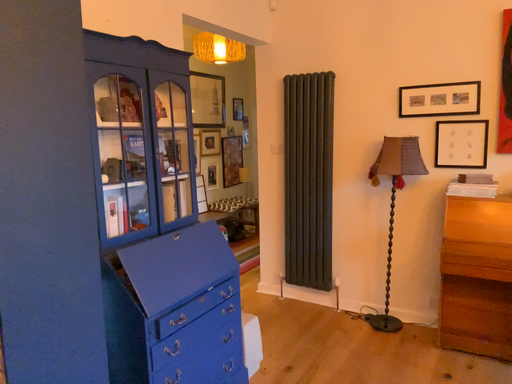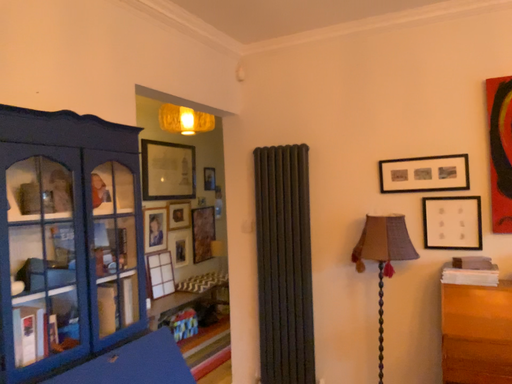
Question: Which way did the camera rotate in the video?

Choices:
 (A) rotated downward
 (B) rotated upward

Answer: (B)